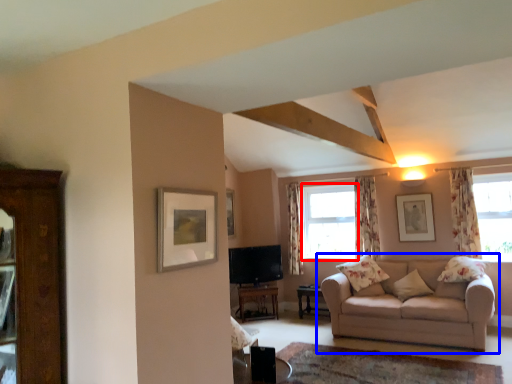
Question: Which object appears farthest to the camera in this image, window (highlighted by a red box) or studio couch (highlighted by a blue box)?

Choices:
 (A) window
 (B) studio couch

Answer: (A)